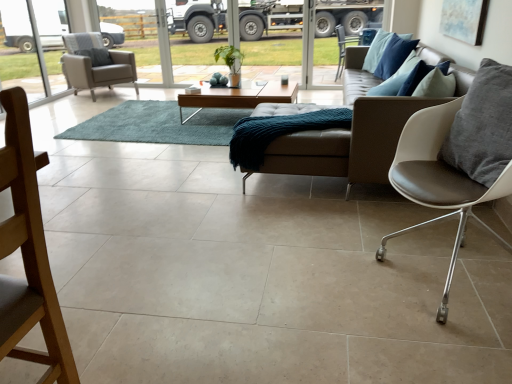
Question: From a real-world perspective, is teal shaggy rug at center above or below light brown wooden coffee table at center?

Choices:
 (A) below
 (B) above

Answer: (A)

Question: In the image, is teal shaggy rug at center on the left side or the right side of light brown wooden coffee table at center?

Choices:
 (A) left
 (B) right

Answer: (A)

Question: Which of these objects is positioned closest to the teal soft fabric blanket at center?

Choices:
 (A) wooden chair at lower left, which ranks as the third chair in back-to-front order
 (B) matte blue painting at upper right
 (C) light brown wooden coffee table at center
 (D) light gray fabric chair at left
 (E) teal shaggy rug at center

Answer: (C)

Question: Which is farther from the matte blue painting at upper right?

Choices:
 (A) teal soft fabric blanket at center
 (B) white leather chair at right, acting as the third chair starting from the left
 (C) teal shaggy rug at center
 (D) leather couch at center
 (E) light gray fabric armchair at left, the third chair viewed from the front

Answer: (E)